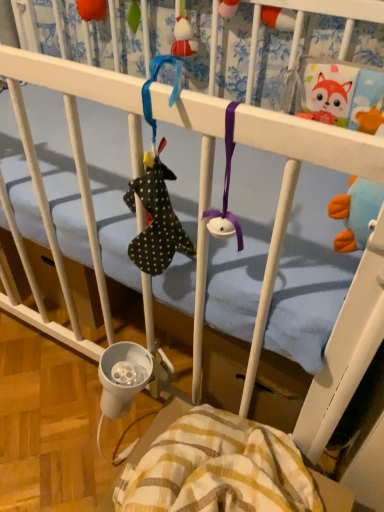
Question: From a real-world perspective, is matte red plush toy at upper center, the first toy positioned from the right, located beneath orange fabric toy at upper left, positioned as the first toy in left-to-right order?

Choices:
 (A) no
 (B) yes

Answer: (B)

Question: Does matte red plush toy at upper center, which ranks as the second toy in left-to-right order, have a smaller size compared to orange fabric toy at upper left, which is the 2th toy in right-to-left order?

Choices:
 (A) yes
 (B) no

Answer: (B)

Question: Considering the relative sizes of matte red plush toy at upper center, the first toy positioned from the right, and orange fabric toy at upper left, which is the 2th toy in right-to-left order, in the image provided, is matte red plush toy at upper center, the first toy positioned from the right, bigger than orange fabric toy at upper left, which is the 2th toy in right-to-left order,?

Choices:
 (A) yes
 (B) no

Answer: (A)

Question: Can we say matte red plush toy at upper center, the first toy positioned from the right, lies outside orange fabric toy at upper left, which is the 2th toy in right-to-left order?

Choices:
 (A) yes
 (B) no

Answer: (A)

Question: Does matte red plush toy at upper center, which ranks as the second toy in left-to-right order, contain orange fabric toy at upper left, which is the 2th toy in right-to-left order?

Choices:
 (A) no
 (B) yes

Answer: (A)

Question: Considering the relative sizes of matte red plush toy at upper center, which ranks as the second toy in left-to-right order, and orange fabric toy at upper left, which is the 2th toy in right-to-left order, in the image provided, is matte red plush toy at upper center, which ranks as the second toy in left-to-right order, shorter than orange fabric toy at upper left, which is the 2th toy in right-to-left order,?

Choices:
 (A) yes
 (B) no

Answer: (B)

Question: Is yellow striped fabric at lower center further to camera compared to matte red plush toy at upper center, which ranks as the second toy in left-to-right order?

Choices:
 (A) no
 (B) yes

Answer: (A)

Question: Is matte red plush toy at upper center, which ranks as the second toy in left-to-right order, at the back of yellow striped fabric at lower center?

Choices:
 (A) yes
 (B) no

Answer: (B)

Question: Does yellow striped fabric at lower center touch matte red plush toy at upper center, which ranks as the second toy in left-to-right order?

Choices:
 (A) no
 (B) yes

Answer: (A)

Question: Does yellow striped fabric at lower center have a smaller size compared to matte red plush toy at upper center, which ranks as the second toy in left-to-right order?

Choices:
 (A) no
 (B) yes

Answer: (A)

Question: Considering the relative sizes of yellow striped fabric at lower center and matte red plush toy at upper center, which ranks as the second toy in left-to-right order, in the image provided, is yellow striped fabric at lower center taller than matte red plush toy at upper center, which ranks as the second toy in left-to-right order,?

Choices:
 (A) yes
 (B) no

Answer: (A)

Question: Does yellow striped fabric at lower center appear on the right side of matte red plush toy at upper center, which ranks as the second toy in left-to-right order?

Choices:
 (A) no
 (B) yes

Answer: (B)

Question: Can you confirm if orange fabric toy at upper left, which is the 2th toy in right-to-left order, is thinner than matte red plush toy at upper center, which ranks as the second toy in left-to-right order?

Choices:
 (A) no
 (B) yes

Answer: (B)